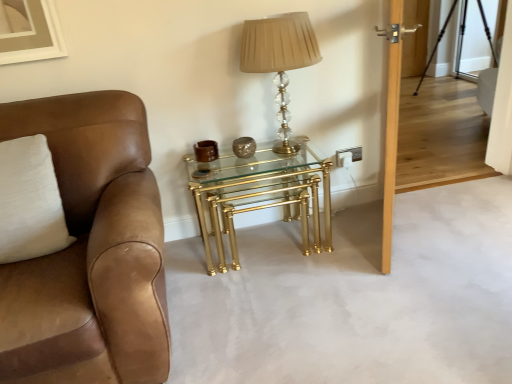
What is the approximate height of translucent crystal table lamp at upper center?

translucent crystal table lamp at upper center is 23.33 inches in height.

The height and width of the screenshot is (384, 512). Describe the element at coordinates (260, 195) in the screenshot. I see `gold metallic nesting tables at center` at that location.

Measure the distance between clear glass door at upper right, the second glass door positioned from the right, and camera.

clear glass door at upper right, the second glass door positioned from the right, and camera are 4.27 meters apart from each other.

Image resolution: width=512 pixels, height=384 pixels. What do you see at coordinates (415, 37) in the screenshot?
I see `clear glass door at upper right, the second glass door positioned from the right` at bounding box center [415, 37].

Where is `transparent glass door at upper right, the second glass door viewed from the left`? The height and width of the screenshot is (384, 512). transparent glass door at upper right, the second glass door viewed from the left is located at coordinates (462, 47).

Is transparent glass door at upper right, the second glass door viewed from the left, not within gold metallic nesting tables at center?

transparent glass door at upper right, the second glass door viewed from the left, lies outside gold metallic nesting tables at center's area.

Is transparent glass door at upper right, the second glass door viewed from the left, aimed at gold metallic nesting tables at center?

No, transparent glass door at upper right, the second glass door viewed from the left, is not facing towards gold metallic nesting tables at center.

Does transparent glass door at upper right, which is counted as the first glass door, starting from the right, have a smaller size compared to gold metallic nesting tables at center?

Yes.

From a real-world perspective, is transparent glass door at upper right, which is counted as the first glass door, starting from the right, above or below gold metallic nesting tables at center?

transparent glass door at upper right, which is counted as the first glass door, starting from the right, is above gold metallic nesting tables at center.

Does transparent glass door at upper right, the second glass door viewed from the left, have a lesser width compared to white soft pillow at left?

Yes.

Is transparent glass door at upper right, the second glass door viewed from the left, facing away from white soft pillow at left?

No, transparent glass door at upper right, the second glass door viewed from the left, is not facing the opposite direction of white soft pillow at left.

Are transparent glass door at upper right, the second glass door viewed from the left, and white soft pillow at left located far from each other?

Yes, transparent glass door at upper right, the second glass door viewed from the left, and white soft pillow at left are quite far apart.

Is transparent glass door at upper right, the second glass door viewed from the left, bigger than white soft pillow at left?

No.

From a real-world perspective, which is physically above, translucent crystal table lamp at upper center or white soft pillow at left?

translucent crystal table lamp at upper center.

Does translucent crystal table lamp at upper center have a greater height compared to white soft pillow at left?

Yes.

Between point (243, 48) and point (28, 216), which one is positioned in front?

The point (28, 216) is in front.

Is transparent glass door at upper right, the second glass door viewed from the left, located outside clear glass door at upper right, the 1th glass door when ordered from left to right?

Yes, transparent glass door at upper right, the second glass door viewed from the left, is outside of clear glass door at upper right, the 1th glass door when ordered from left to right.

Is transparent glass door at upper right, the second glass door viewed from the left, bigger or smaller than clear glass door at upper right, the 1th glass door when ordered from left to right?

Clearly, transparent glass door at upper right, the second glass door viewed from the left, is larger in size than clear glass door at upper right, the 1th glass door when ordered from left to right.

Locate an element on the screen. The width and height of the screenshot is (512, 384). glass door below the transparent glass door at upper right, the second glass door viewed from the left (from a real-world perspective) is located at coordinates (415, 37).

Considering the points (65, 342) and (227, 226), which point is in front, point (65, 342) or point (227, 226)?

The point (65, 342) is closer.

Is brown leather chair at left further to the viewer compared to gold metallic nesting tables at center?

No.

Looking at their sizes, would you say brown leather chair at left is wider or thinner than gold metallic nesting tables at center?

Considering their sizes, brown leather chair at left looks broader than gold metallic nesting tables at center.

Locate an element on the screen. chair below the gold metallic nesting tables at center (from the image's perspective) is located at coordinates (90, 251).

This screenshot has height=384, width=512. I want to click on chair below the translucent crystal table lamp at upper center (from the image's perspective), so click(x=90, y=251).

Considering the positions of point (261, 33) and point (49, 344), is point (261, 33) closer or farther from the camera than point (49, 344)?

Point (261, 33) appears to be farther away from the viewer than point (49, 344).

Is translucent crystal table lamp at upper center inside or outside of brown leather chair at left?

translucent crystal table lamp at upper center is outside brown leather chair at left.

Which object is closer to the camera, gold metallic nesting tables at center or translucent crystal table lamp at upper center?

Positioned in front is translucent crystal table lamp at upper center.

Could translucent crystal table lamp at upper center be considered to be inside gold metallic nesting tables at center?

No, translucent crystal table lamp at upper center is not inside gold metallic nesting tables at center.

Are gold metallic nesting tables at center and translucent crystal table lamp at upper center located far from each other?

No.

Locate an element on the screen. This screenshot has height=384, width=512. table in front of the transparent glass door at upper right, the second glass door viewed from the left is located at coordinates (260, 195).

From a real-world perspective, which glass door is the 1st one underneath the white soft pillow at left? Please provide its 2D coordinates.

[(462, 47)]

From the image, which object appears to be farther from brown leather chair at left, transparent glass door at upper right, which is counted as the first glass door, starting from the right, or clear glass door at upper right, the 1th glass door when ordered from left to right?

Among the two, clear glass door at upper right, the 1th glass door when ordered from left to right, is located further to brown leather chair at left.

Consider the image. From the image, which object appears to be farther from gold metallic nesting tables at center, brown leather chair at left or clear glass door at upper right, the 1th glass door when ordered from left to right?

clear glass door at upper right, the 1th glass door when ordered from left to right, lies further to gold metallic nesting tables at center than the other object.

Consider the image. Which object lies nearer to the anchor point white soft pillow at left, translucent crystal table lamp at upper center or clear glass door at upper right, the second glass door positioned from the right?

translucent crystal table lamp at upper center is positioned closer to the anchor white soft pillow at left.

Estimate the real-world distances between objects in this image. Which object is closer to brown leather chair at left, gold metallic nesting tables at center or clear glass door at upper right, the 1th glass door when ordered from left to right?

gold metallic nesting tables at center is closer to brown leather chair at left.

From the image, which object appears to be farther from clear glass door at upper right, the second glass door positioned from the right, brown leather chair at left or gold metallic nesting tables at center?

brown leather chair at left.

Estimate the real-world distances between objects in this image. Which object is closer to gold metallic nesting tables at center, transparent glass door at upper right, which is counted as the first glass door, starting from the right, or translucent crystal table lamp at upper center?

translucent crystal table lamp at upper center.

Looking at the image, which one is located further to gold metallic nesting tables at center, clear glass door at upper right, the 1th glass door when ordered from left to right, or translucent crystal table lamp at upper center?

clear glass door at upper right, the 1th glass door when ordered from left to right, is positioned further to the anchor gold metallic nesting tables at center.

Based on their spatial positions, is white soft pillow at left or brown leather chair at left closer to translucent crystal table lamp at upper center?

brown leather chair at left is positioned closer to the anchor translucent crystal table lamp at upper center.

What are the coordinates of `chair between white soft pillow at left and transparent glass door at upper right, the second glass door viewed from the left, from left to right` in the screenshot? It's located at (90, 251).

You are a GUI agent. You are given a task and a screenshot of the screen. Output one action in this format:
    pyautogui.click(x=<x>, y=<y>)
    Task: Click on the glass door positioned between gold metallic nesting tables at center and clear glass door at upper right, the 1th glass door when ordered from left to right, from near to far
    The width and height of the screenshot is (512, 384).
    Given the screenshot: What is the action you would take?
    pyautogui.click(x=462, y=47)

Find the location of a particular element. Image resolution: width=512 pixels, height=384 pixels. table between translucent crystal table lamp at upper center and transparent glass door at upper right, which is counted as the first glass door, starting from the right, from front to back is located at coordinates (260, 195).

Find the location of a particular element. table between translucent crystal table lamp at upper center and clear glass door at upper right, the 1th glass door when ordered from left to right, along the z-axis is located at coordinates [260, 195].